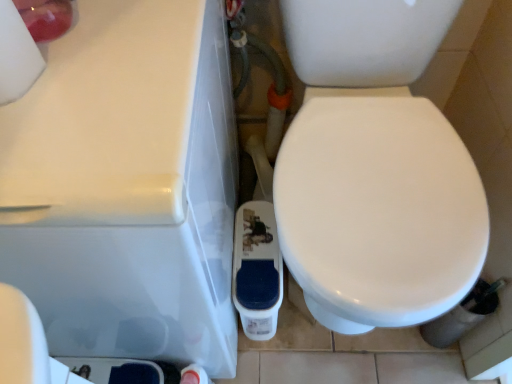
Question: Considering the relative sizes of white matte toilet paper at upper left and white glossy porcelain at center in the image provided, is white matte toilet paper at upper left taller than white glossy porcelain at center?

Choices:
 (A) yes
 (B) no

Answer: (B)

Question: From a real-world perspective, is white matte toilet paper at upper left over white glossy porcelain at center?

Choices:
 (A) no
 (B) yes

Answer: (B)

Question: Is white matte toilet paper at upper left at the right side of white glossy porcelain at center?

Choices:
 (A) no
 (B) yes

Answer: (A)

Question: Can you confirm if white matte toilet paper at upper left is smaller than white glossy porcelain at center?

Choices:
 (A) no
 (B) yes

Answer: (B)

Question: Can you confirm if white matte toilet paper at upper left is shorter than white glossy porcelain at center?

Choices:
 (A) no
 (B) yes

Answer: (B)

Question: Is white matte toilet paper at upper left next to white glossy porcelain at center?

Choices:
 (A) yes
 (B) no

Answer: (B)

Question: Would you say white glossy bidet at center is outside white matte toilet paper at upper left?

Choices:
 (A) no
 (B) yes

Answer: (B)

Question: Is white matte toilet paper at upper left a part of white glossy bidet at center?

Choices:
 (A) yes
 (B) no

Answer: (B)

Question: Is white glossy bidet at center smaller than white matte toilet paper at upper left?

Choices:
 (A) yes
 (B) no

Answer: (B)

Question: Are white glossy bidet at center and white matte toilet paper at upper left located far from each other?

Choices:
 (A) yes
 (B) no

Answer: (B)

Question: Considering the relative positions of white glossy bidet at center and white matte toilet paper at upper left in the image provided, is white glossy bidet at center to the left of white matte toilet paper at upper left from the viewer's perspective?

Choices:
 (A) no
 (B) yes

Answer: (A)

Question: Is white glossy bidet at center positioned before white matte toilet paper at upper left?

Choices:
 (A) yes
 (B) no

Answer: (B)

Question: Is white glossy porcelain at center located outside white matte toilet paper at upper left?

Choices:
 (A) no
 (B) yes

Answer: (B)